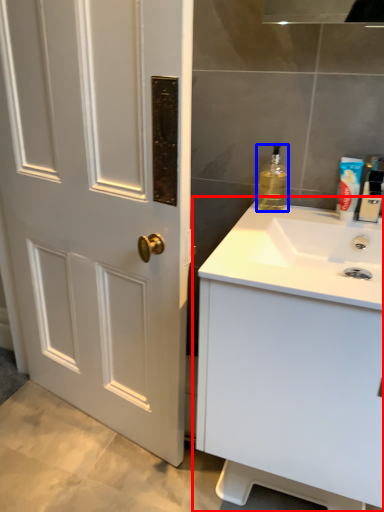
Question: Which object is further to the camera taking this photo, bathroom cabinet (highlighted by a red box) or bottle (highlighted by a blue box)?

Choices:
 (A) bathroom cabinet
 (B) bottle

Answer: (B)